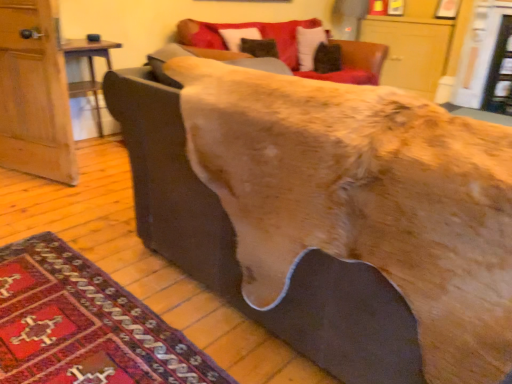
Question: From a real-world perspective, is carpeted rug at lower left positioned above or below brown leather couch at center?

Choices:
 (A) below
 (B) above

Answer: (A)

Question: Is point (172, 352) positioned closer to the camera than point (349, 365)?

Choices:
 (A) closer
 (B) farther

Answer: (B)

Question: Which object is positioned farthest from the carpeted rug at lower left?

Choices:
 (A) brown leather couch at center
 (B) wooden table at left
 (C) velvet-like brown pillow at upper center

Answer: (C)

Question: Which object is positioned closest to the wooden table at left?

Choices:
 (A) brown leather couch at center
 (B) carpeted rug at lower left
 (C) velvet-like brown pillow at upper center

Answer: (A)